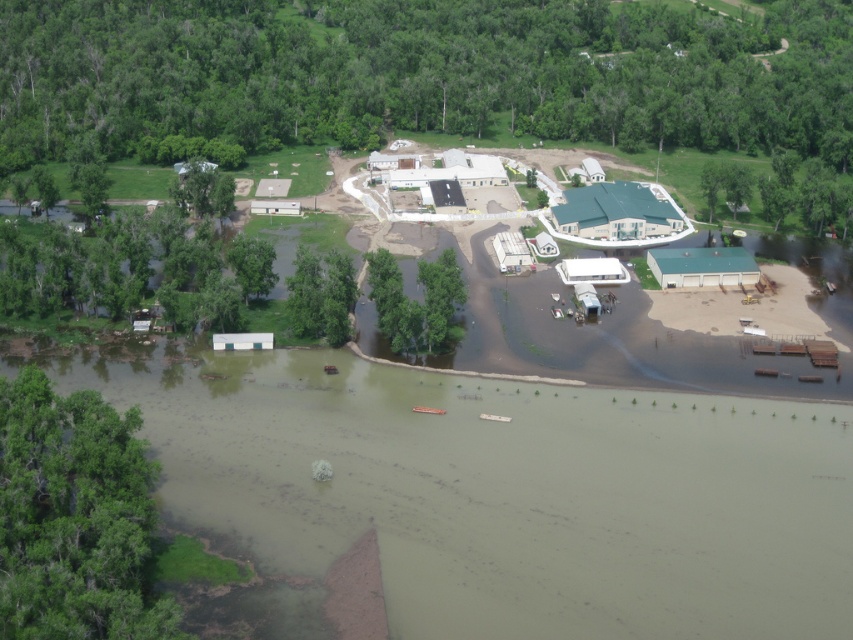
Looking at this image, is green leafy tree at lower left taller than green leafy tree at center?

Indeed, green leafy tree at lower left has a greater height compared to green leafy tree at center.

Measure the distance between green leafy tree at lower left and green leafy tree at center.

A distance of 54.42 meters exists between green leafy tree at lower left and green leafy tree at center.

Find the location of a particular element. Image resolution: width=853 pixels, height=640 pixels. green leafy tree at lower left is located at coordinates (73, 516).

Who is shorter, green leafy tree at upper center or green leafy tree at center?

With less height is green leafy tree at center.

Is green leafy tree at upper center bigger than green leafy tree at center?

Correct, green leafy tree at upper center is larger in size than green leafy tree at center.

Is point (360, 67) positioned after point (376, 300)?

Yes, it is.

This screenshot has width=853, height=640. What are the coordinates of `green leafy tree at upper center` in the screenshot? It's located at (415, 76).

In the scene shown: Can you confirm if green leafy tree at upper center is thinner than green leafy tree at lower left?

In fact, green leafy tree at upper center might be wider than green leafy tree at lower left.

Which of these two, green leafy tree at upper center or green leafy tree at lower left, stands taller?

Standing taller between the two is green leafy tree at upper center.

Between point (386, 104) and point (26, 385), which one is positioned in front?

Point (26, 385) is in front.

You are a GUI agent. You are given a task and a screenshot of the screen. Output one action in this format:
    pyautogui.click(x=<x>, y=<y>)
    Task: Click on the green leafy tree at upper center
    
    Given the screenshot: What is the action you would take?
    pyautogui.click(x=415, y=76)